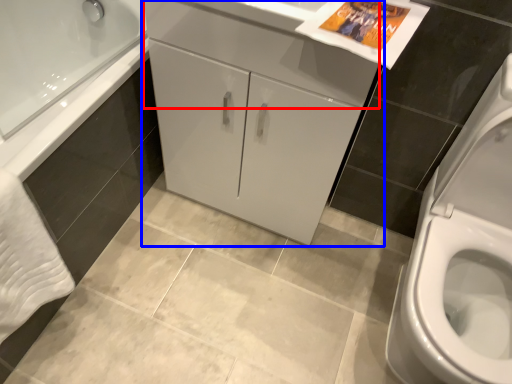
Question: Among these objects, which one is farthest to the camera, drawer (highlighted by a red box) or bathroom cabinet (highlighted by a blue box)?

Choices:
 (A) drawer
 (B) bathroom cabinet

Answer: (B)